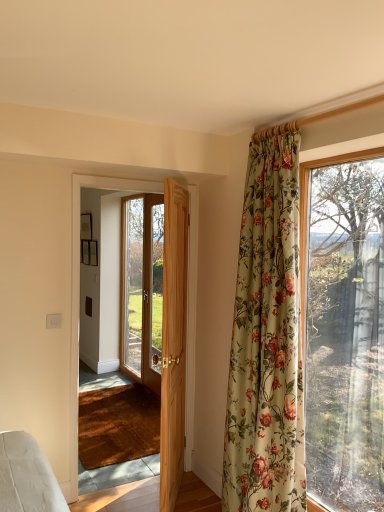
Question: Is light brown wooden door at center, the 3th door in the back-to-front sequence, not near wooden door at center, marked as the first door in a back-to-front arrangement?

Choices:
 (A) yes
 (B) no

Answer: (A)

Question: Can you confirm if light brown wooden door at center, the 1th door viewed from the front, is taller than wooden door at center, which is counted as the third door, starting from the front?

Choices:
 (A) no
 (B) yes

Answer: (A)

Question: Can you confirm if light brown wooden door at center, the 1th door viewed from the front, is wider than wooden door at center, which is counted as the third door, starting from the front?

Choices:
 (A) no
 (B) yes

Answer: (B)

Question: From the image's perspective, is light brown wooden door at center, the 3th door in the back-to-front sequence, above wooden door at center, marked as the first door in a back-to-front arrangement?

Choices:
 (A) yes
 (B) no

Answer: (B)

Question: From a real-world perspective, is light brown wooden door at center, the 3th door in the back-to-front sequence, on wooden door at center, which is counted as the third door, starting from the front?

Choices:
 (A) yes
 (B) no

Answer: (B)

Question: From their relative heights in the image, would you say floral fabric curtain at right is taller or shorter than wooden door at center, the second door when ordered from front to back?

Choices:
 (A) tall
 (B) short

Answer: (A)

Question: From a real-world perspective, is floral fabric curtain at right positioned above or below wooden door at center, which ranks as the second door in back-to-front order?

Choices:
 (A) below
 (B) above

Answer: (B)

Question: Considering the positions of floral fabric curtain at right and wooden door at center, which ranks as the second door in back-to-front order, in the image, is floral fabric curtain at right bigger or smaller than wooden door at center, which ranks as the second door in back-to-front order,?

Choices:
 (A) small
 (B) big

Answer: (B)

Question: From the image's perspective, is floral fabric curtain at right positioned above or below wooden door at center, which ranks as the second door in back-to-front order?

Choices:
 (A) above
 (B) below

Answer: (A)

Question: Considering their positions, is wooden door at center, the second door when ordered from front to back, located in front of or behind wooden door at center, which is counted as the third door, starting from the front?

Choices:
 (A) front
 (B) behind

Answer: (A)

Question: In terms of size, does wooden door at center, the second door when ordered from front to back, appear bigger or smaller than wooden door at center, which is counted as the third door, starting from the front?

Choices:
 (A) small
 (B) big

Answer: (A)

Question: Is wooden door at center, the second door when ordered from front to back, to the left or to the right of wooden door at center, which is counted as the third door, starting from the front, in the image?

Choices:
 (A) left
 (B) right

Answer: (B)

Question: From a real-world perspective, is wooden door at center, which ranks as the second door in back-to-front order, positioned above or below wooden door at center, marked as the first door in a back-to-front arrangement?

Choices:
 (A) below
 (B) above

Answer: (A)

Question: From a real-world perspective, is light brown wooden door at center, the 3th door in the back-to-front sequence, above or below wooden door at center, which ranks as the second door in back-to-front order?

Choices:
 (A) above
 (B) below

Answer: (B)

Question: In terms of width, does light brown wooden door at center, the 1th door viewed from the front, look wider or thinner when compared to wooden door at center, which ranks as the second door in back-to-front order?

Choices:
 (A) wide
 (B) thin

Answer: (A)